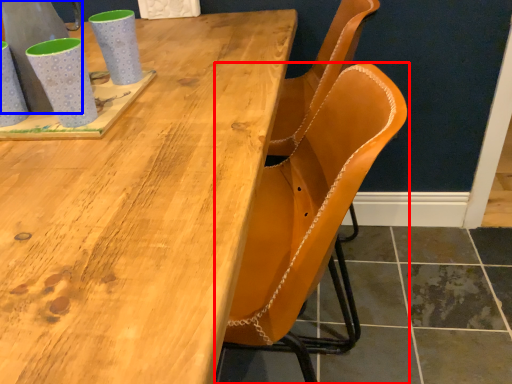
Question: Which object appears closest to the camera in this image, chair (highlighted by a red box) or gray (highlighted by a blue box)?

Choices:
 (A) chair
 (B) gray

Answer: (B)